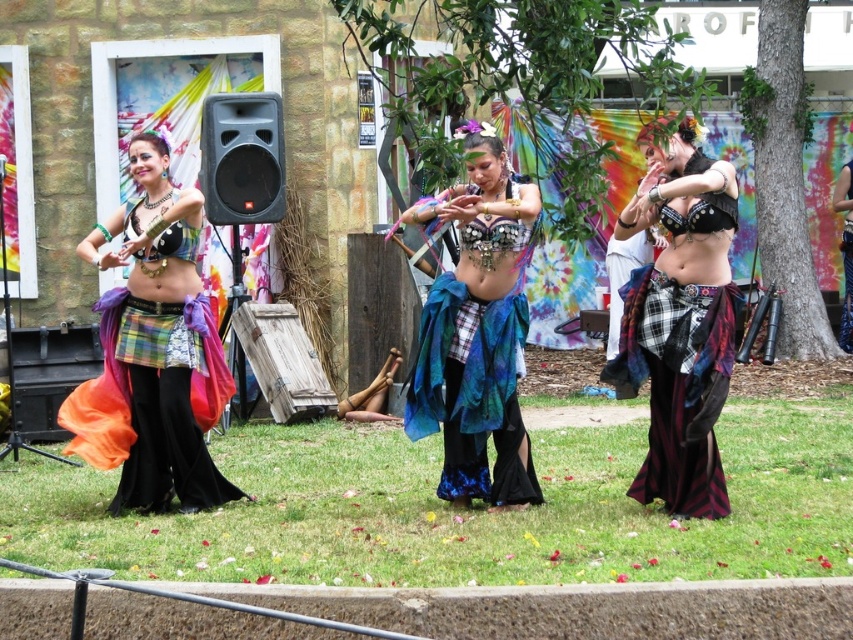
Question: Can you confirm if plaid fabric skirt at center is positioned to the right of shiny blue fabric skirt at center?

Choices:
 (A) no
 (B) yes

Answer: (B)

Question: Which point is closer to the camera taking this photo?

Choices:
 (A) pos(450,403)
 (B) pos(698,280)

Answer: (B)

Question: Among these points, which one is nearest to the camera?

Choices:
 (A) (461, 456)
 (B) (142, 480)

Answer: (A)

Question: In this image, where is plaid fabric skirt at center located relative to shiny blue fabric skirt at center?

Choices:
 (A) above
 (B) below

Answer: (A)

Question: Is plaid fabric skirt at center bigger than shiny blue fabric skirt at center?

Choices:
 (A) yes
 (B) no

Answer: (B)

Question: Which object is the farthest from the plaid fabric skirt at center?

Choices:
 (A) shiny blue fabric skirt at center
 (B) matte plaid skirt at center

Answer: (B)